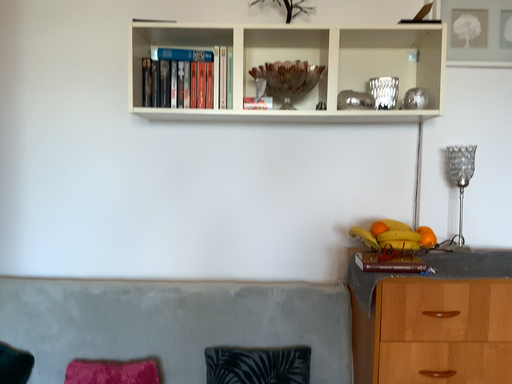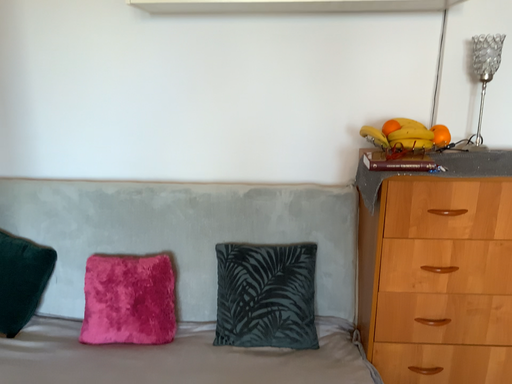
Question: How did the camera likely rotate when shooting the video?

Choices:
 (A) rotated downward
 (B) rotated upward

Answer: (A)